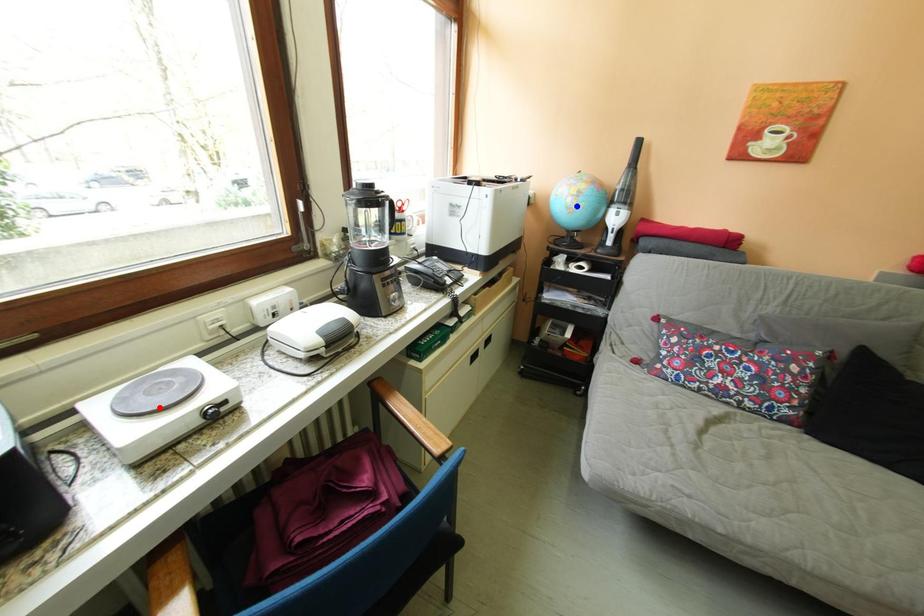
Question: Two points are marked on the image. Which point is closer to the camera?

Choices:
 (A) Blue point is closer.
 (B) Red point is closer.

Answer: (B)